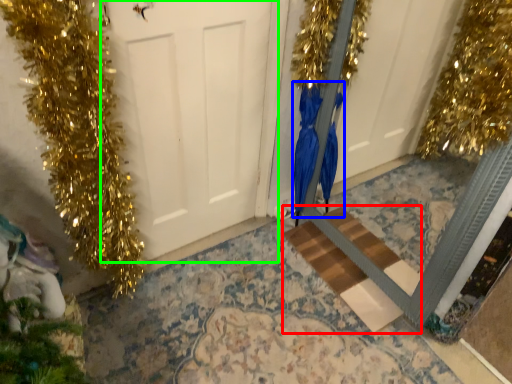
Question: Considering the real-world distances, which object is closest to stairwell (highlighted by a red box)? dress (highlighted by a blue box) or door (highlighted by a green box).

Choices:
 (A) dress
 (B) door

Answer: (A)